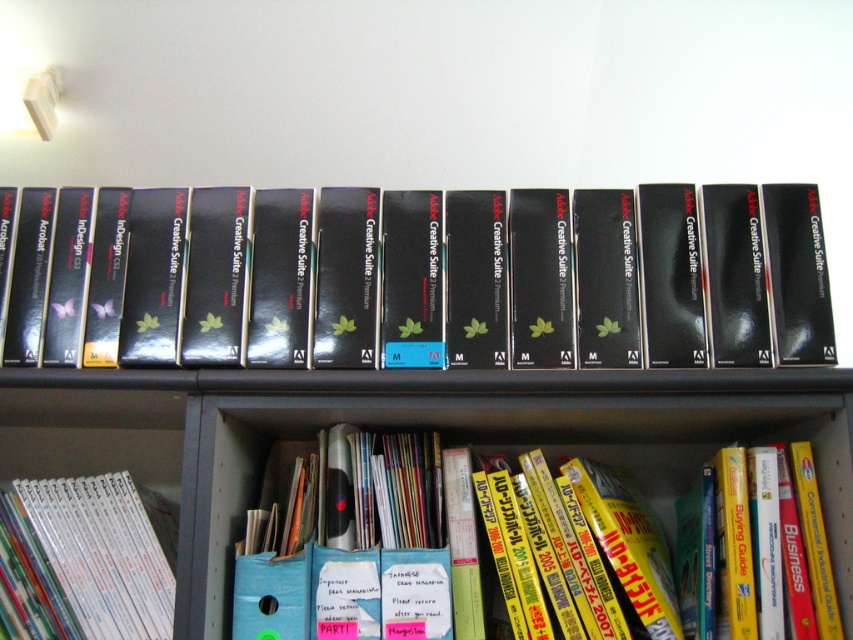
Based on the photo, who is taller, black matte adobe creative suite premium at center or yellow glossy book at lower center?

yellow glossy book at lower center is taller.

Is black matte adobe creative suite premium at center to the right of yellow glossy book at lower center from the viewer's perspective?

No, black matte adobe creative suite premium at center is not to the right of yellow glossy book at lower center.

In order to click on black matte adobe creative suite premium at center in this screenshot , I will do (x=556, y=280).

You are a GUI agent. You are given a task and a screenshot of the screen. Output one action in this format:
    pyautogui.click(x=<x>, y=<y>)
    Task: Click on the black matte adobe creative suite premium at center
    
    Given the screenshot: What is the action you would take?
    pyautogui.click(x=556, y=280)

Between point (781, 305) and point (67, 492), which one is positioned in front?

Point (781, 305)

Does black matte adobe creative suite premium at center have a lesser height compared to white glossy book at lower left?

Incorrect, black matte adobe creative suite premium at center's height does not fall short of white glossy book at lower left's.

Who is more forward, (653, 323) or (146, 618)?

Point (146, 618) is more forward.

At what (x,y) coordinates should I click in order to perform the action: click on black matte adobe creative suite premium at center. Please return your answer as a coordinate pair (x, y). This screenshot has width=853, height=640. Looking at the image, I should click on (556, 280).

This screenshot has width=853, height=640. What do you see at coordinates (604, 545) in the screenshot? I see `yellow glossy book at lower center` at bounding box center [604, 545].

Between yellow glossy book at lower center and white glossy book at lower left, which one is positioned higher?

yellow glossy book at lower center is above.

The height and width of the screenshot is (640, 853). What are the coordinates of `yellow glossy book at lower center` in the screenshot? It's located at (604, 545).